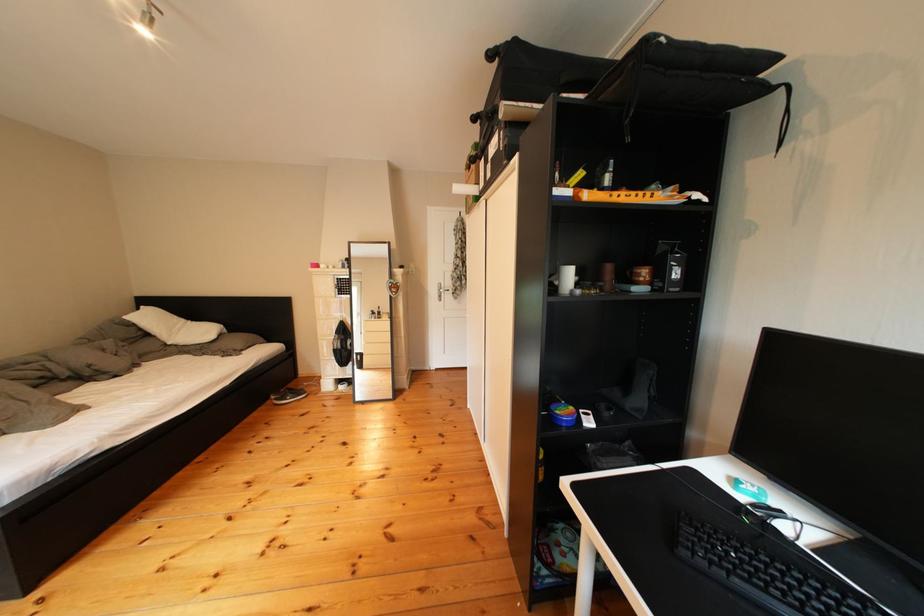
This screenshot has height=616, width=924. What do you see at coordinates (633, 196) in the screenshot?
I see `a orange cardboard box` at bounding box center [633, 196].